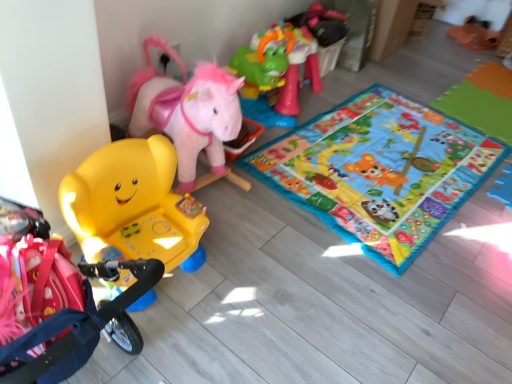
Question: Would you say green plastic horse at upper right, marked as the 2th toy in a left-to-right arrangement, is part of matte yellow plastic chair at left, positioned as the first toy in front-to-back order,'s contents?

Choices:
 (A) no
 (B) yes

Answer: (A)

Question: Considering the relative sizes of matte yellow plastic chair at left, which is the first toy from bottom to top, and green plastic horse at upper right, positioned as the 2th toy in bottom-to-top order, in the image provided, is matte yellow plastic chair at left, which is the first toy from bottom to top, bigger than green plastic horse at upper right, positioned as the 2th toy in bottom-to-top order,?

Choices:
 (A) no
 (B) yes

Answer: (A)

Question: Can you confirm if matte yellow plastic chair at left, arranged as the second toy when viewed from the top, is taller than green plastic horse at upper right, positioned as the 1th toy in top-to-bottom order?

Choices:
 (A) yes
 (B) no

Answer: (A)

Question: Does matte yellow plastic chair at left, which is counted as the second toy, starting from the back, have a smaller size compared to green plastic horse at upper right, the 1th toy positioned from the right?

Choices:
 (A) yes
 (B) no

Answer: (A)

Question: Does matte yellow plastic chair at left, which is counted as the second toy, starting from the back, turn towards green plastic horse at upper right, positioned as the 1th toy in top-to-bottom order?

Choices:
 (A) yes
 (B) no

Answer: (B)

Question: Relative to multicolored fabric playmat at center, is green plastic horse at upper right, the 2th toy from the front, in front or behind?

Choices:
 (A) behind
 (B) front

Answer: (A)

Question: From a real-world perspective, relative to multicolored fabric playmat at center, is green plastic horse at upper right, which is counted as the first toy, starting from the back, vertically above or below?

Choices:
 (A) above
 (B) below

Answer: (A)

Question: Considering the positions of green plastic horse at upper right, the 2th toy from the front, and multicolored fabric playmat at center in the image, is green plastic horse at upper right, the 2th toy from the front, taller or shorter than multicolored fabric playmat at center?

Choices:
 (A) short
 (B) tall

Answer: (B)

Question: Is green plastic horse at upper right, marked as the 2th toy in a left-to-right arrangement, inside or outside of multicolored fabric playmat at center?

Choices:
 (A) inside
 (B) outside

Answer: (B)

Question: Is green plastic horse at upper right, the 2th toy from the front, inside the boundaries of matte yellow plastic chair at left, positioned as the first toy in front-to-back order, or outside?

Choices:
 (A) inside
 (B) outside

Answer: (B)

Question: Based on their positions, is green plastic horse at upper right, marked as the 2th toy in a left-to-right arrangement, located to the left or right of matte yellow plastic chair at left, which is counted as the second toy, starting from the back?

Choices:
 (A) left
 (B) right

Answer: (B)

Question: Considering the positions of point (262, 44) and point (159, 251), is point (262, 44) closer or farther from the camera than point (159, 251)?

Choices:
 (A) farther
 (B) closer

Answer: (A)

Question: From a real-world perspective, is green plastic horse at upper right, the 2th toy from the front, positioned above or below matte yellow plastic chair at left, arranged as the second toy when viewed from the top?

Choices:
 (A) below
 (B) above

Answer: (A)

Question: From a real-world perspective, is multicolored fabric playmat at center above or below matte yellow plastic chair at left, which is counted as the second toy, starting from the back?

Choices:
 (A) above
 (B) below

Answer: (B)

Question: Considering the positions of point (315, 215) and point (124, 153), is point (315, 215) closer or farther from the camera than point (124, 153)?

Choices:
 (A) closer
 (B) farther

Answer: (B)